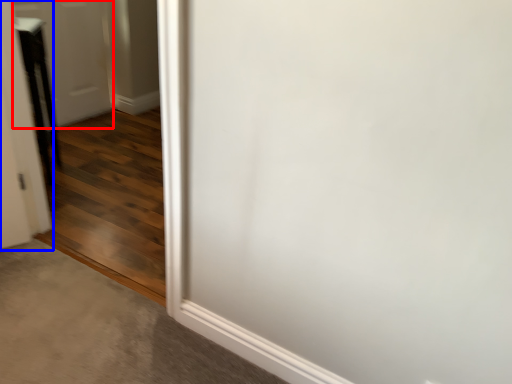
Question: Which of the following is the closest to the observer, door (highlighted by a red box) or door (highlighted by a blue box)?

Choices:
 (A) door
 (B) door

Answer: (B)